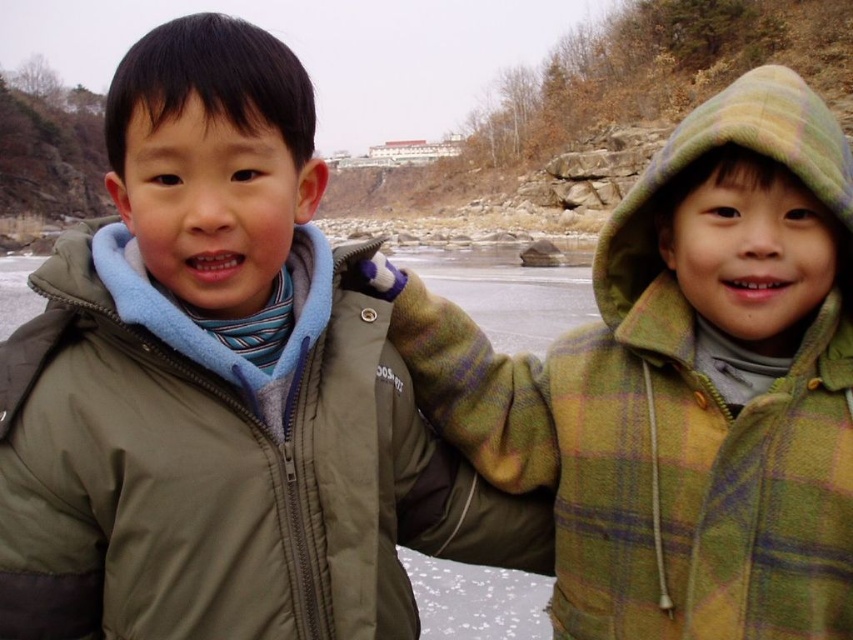
Does olive green puffer jacket at left appear over green plaid hood at upper right?

No, olive green puffer jacket at left is not above green plaid hood at upper right.

Is point (309, 474) farther from camera compared to point (764, 83)?

No.

This screenshot has width=853, height=640. What do you see at coordinates (224, 465) in the screenshot?
I see `olive green puffer jacket at left` at bounding box center [224, 465].

Find the location of a particular element. The height and width of the screenshot is (640, 853). olive green puffer jacket at left is located at coordinates (224, 465).

Can you confirm if green plaid jacket at right is taller than green plaid hood at upper right?

No.

Identify the location of green plaid jacket at right. This screenshot has width=853, height=640. (683, 387).

Is point (842, 444) positioned before point (642, 204)?

Yes.

Locate an element on the screen. The image size is (853, 640). green plaid jacket at right is located at coordinates (683, 387).

Identify the location of green plaid jacket at right. This screenshot has width=853, height=640. (683, 387).

Consider the image. Which is below, green plaid jacket at right or olive green puffer jacket at left?

olive green puffer jacket at left

Between point (750, 342) and point (315, 384), which one is positioned behind?

The point (750, 342) is more distant.

I want to click on green plaid jacket at right, so click(x=683, y=387).